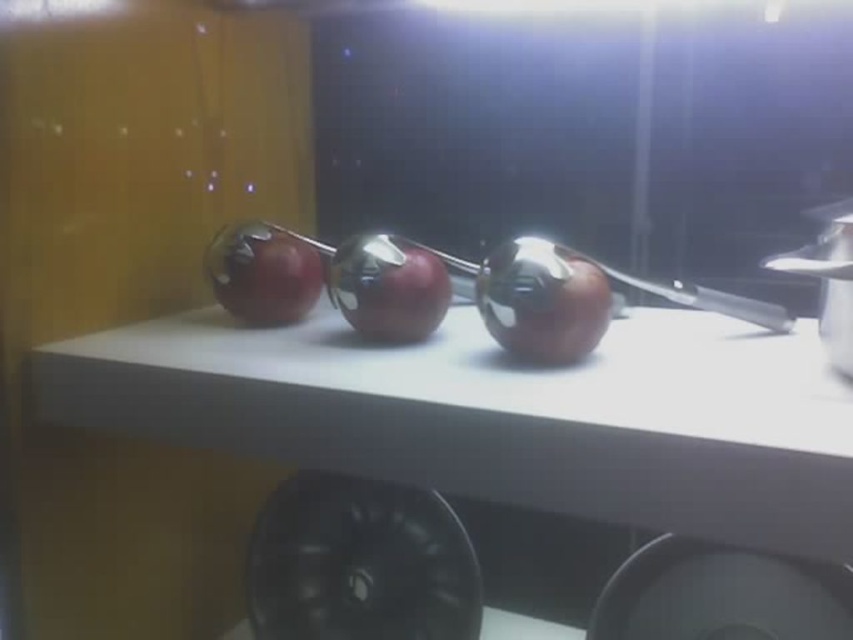
Is shiny metallic apple at center below glossy red apple at center?

Yes, shiny metallic apple at center is below glossy red apple at center.

Is shiny metallic apple at center thinner than glossy red apple at center?

Correct, shiny metallic apple at center's width is less than glossy red apple at center's.

Is point (583, 296) farther from viewer compared to point (283, 278)?

No, it is not.

At what (x,y) coordinates should I click in order to perform the action: click on shiny metallic apple at center. Please return your answer as a coordinate pair (x, y). Looking at the image, I should click on (543, 300).

Which of these two, white matte counter top at center or glossy red apple at center, stands taller?

white matte counter top at center

Does white matte counter top at center appear under glossy red apple at center?

Correct, white matte counter top at center is located below glossy red apple at center.

Is point (416, 362) positioned after point (287, 307)?

No, it is not.

The height and width of the screenshot is (640, 853). In order to click on white matte counter top at center in this screenshot , I will do (x=502, y=413).

Is shiny metallic apple at center closer to the viewer compared to shiny red apple at center?

Yes.

You are a GUI agent. You are given a task and a screenshot of the screen. Output one action in this format:
    pyautogui.click(x=<x>, y=<y>)
    Task: Click on the shiny metallic apple at center
    The image size is (853, 640).
    Given the screenshot: What is the action you would take?
    pyautogui.click(x=543, y=300)

Find the location of a particular element. The width and height of the screenshot is (853, 640). shiny metallic apple at center is located at coordinates (543, 300).

I want to click on shiny metallic apple at center, so click(543, 300).